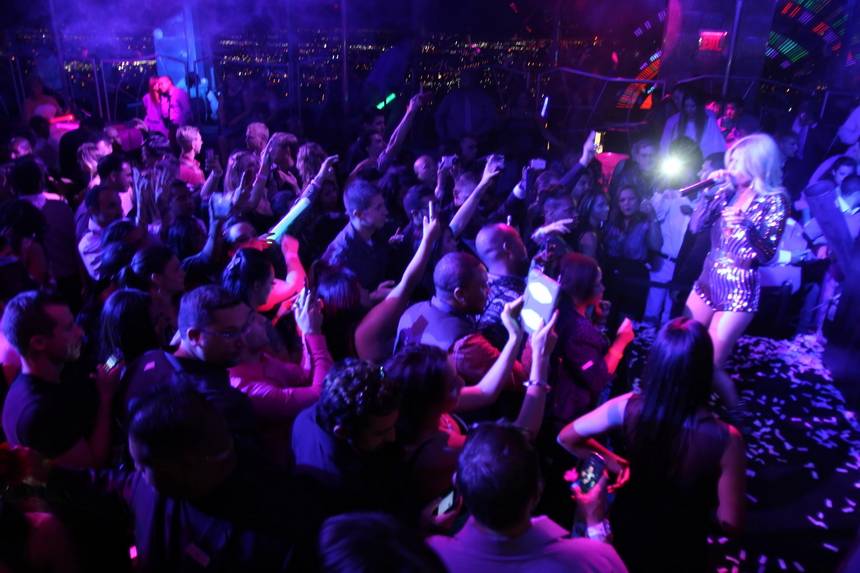
Locate an element on the screen. windows is located at coordinates (415, 37), (277, 39), (175, 43), (60, 53), (484, 26).